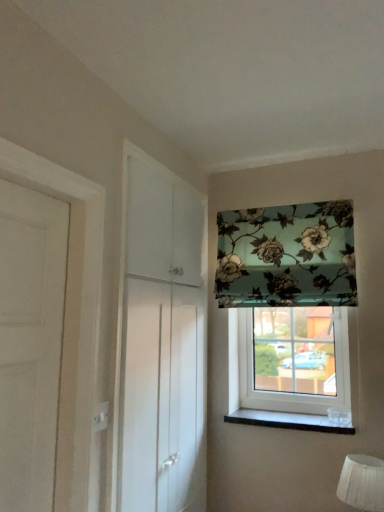
Question: Considering the relative sizes of white fabric lampshade at lower right and white glossy cabinet at left in the image provided, is white fabric lampshade at lower right taller than white glossy cabinet at left?

Choices:
 (A) no
 (B) yes

Answer: (A)

Question: Is white fabric lampshade at lower right at the right side of white glossy cabinet at left?

Choices:
 (A) yes
 (B) no

Answer: (A)

Question: Is white fabric lampshade at lower right far away from white glossy cabinet at left?

Choices:
 (A) no
 (B) yes

Answer: (A)

Question: Is white fabric lampshade at lower right positioned with its back to white glossy cabinet at left?

Choices:
 (A) no
 (B) yes

Answer: (A)

Question: Can you see white fabric lampshade at lower right touching white glossy cabinet at left?

Choices:
 (A) no
 (B) yes

Answer: (A)

Question: Is floral fabric at upper right, which ranks as the 1th window in top-to-bottom order, situated inside white fabric lampshade at lower right or outside?

Choices:
 (A) outside
 (B) inside

Answer: (A)

Question: Is point (347, 265) positioned closer to the camera than point (354, 499)?

Choices:
 (A) closer
 (B) farther

Answer: (B)

Question: From a real-world perspective, relative to white fabric lampshade at lower right, is floral fabric at upper right, which appears as the 2th window when ordered from the bottom, vertically above or below?

Choices:
 (A) below
 (B) above

Answer: (B)

Question: Considering the positions of floral fabric at upper right, which ranks as the 1th window in top-to-bottom order, and white fabric lampshade at lower right in the image, is floral fabric at upper right, which ranks as the 1th window in top-to-bottom order, wider or thinner than white fabric lampshade at lower right?

Choices:
 (A) thin
 (B) wide

Answer: (A)

Question: From a real-world perspective, relative to transparent glass window at center, arranged as the first window when ordered from the bottom, is black marble window sill at lower right vertically above or below?

Choices:
 (A) above
 (B) below

Answer: (B)

Question: From the image's perspective, is black marble window sill at lower right located above or below transparent glass window at center, arranged as the first window when ordered from the bottom?

Choices:
 (A) above
 (B) below

Answer: (B)

Question: Looking at their shapes, would you say black marble window sill at lower right is wider or thinner than transparent glass window at center, arranged as the first window when ordered from the bottom?

Choices:
 (A) wide
 (B) thin

Answer: (A)

Question: From their relative heights in the image, would you say black marble window sill at lower right is taller or shorter than transparent glass window at center, which is counted as the second window, starting from the top?

Choices:
 (A) tall
 (B) short

Answer: (B)

Question: Would you say black marble window sill at lower right is inside or outside floral fabric at upper right, which appears as the 2th window when ordered from the bottom?

Choices:
 (A) inside
 (B) outside

Answer: (B)

Question: Considering their positions, is black marble window sill at lower right located in front of or behind floral fabric at upper right, which appears as the 2th window when ordered from the bottom?

Choices:
 (A) front
 (B) behind

Answer: (B)